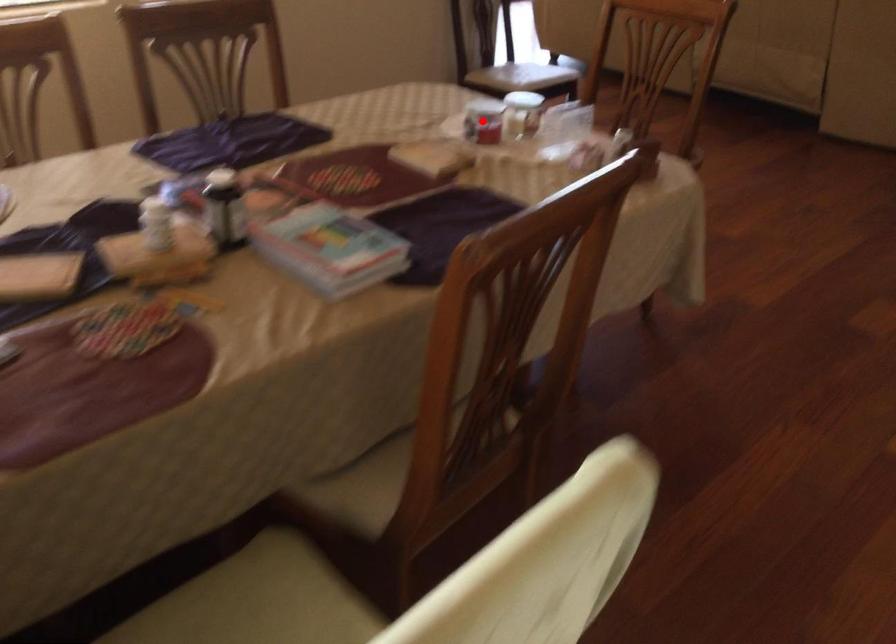
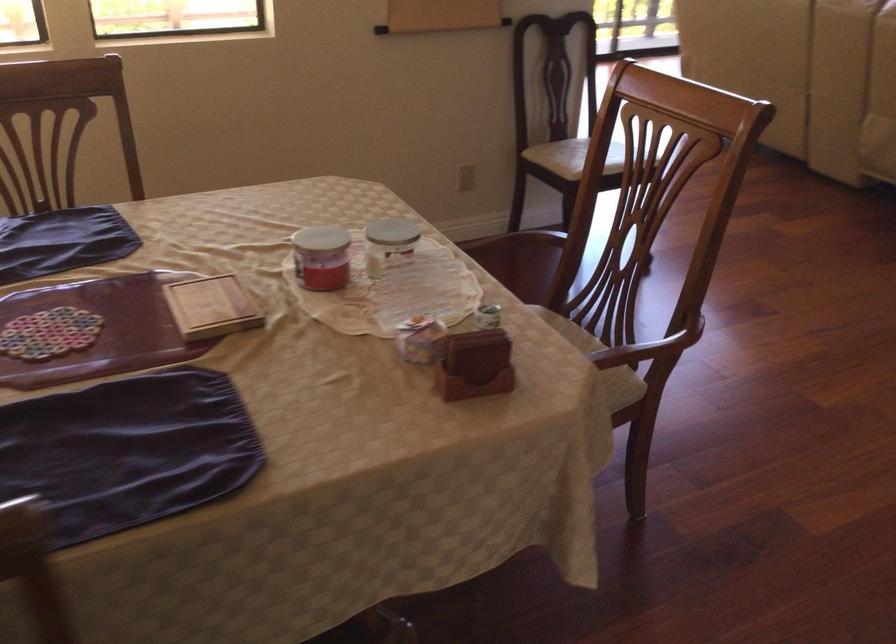
In the second image, find the point that corresponds to the highlighted location in the first image.

(321, 257)